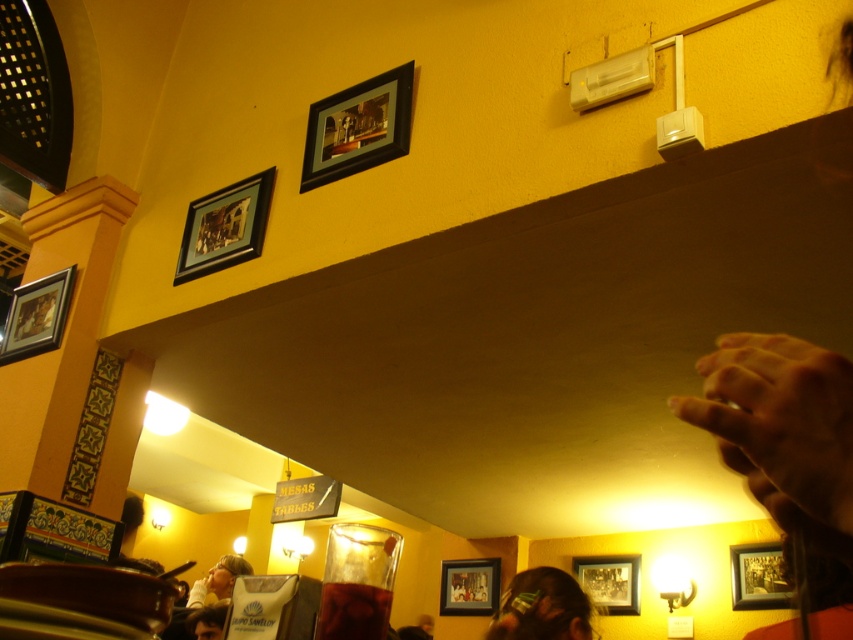
Question: Which point appears farthest from the camera in this image?

Choices:
 (A) (378, 148)
 (B) (41, 282)

Answer: (B)

Question: Is dark brown hair at lower center smaller than wooden picture frame at lower right?

Choices:
 (A) no
 (B) yes

Answer: (B)

Question: Is dark brown hair at lower center above wooden frame at left?

Choices:
 (A) no
 (B) yes

Answer: (A)

Question: Which object is positioned farthest from the wooden picture frame at lower center?

Choices:
 (A) dark brown hair at lower center
 (B) wooden frame at left
 (C) black matte picture frame at upper center
 (D) wooden picture frame at lower right

Answer: (C)

Question: From the image, what is the correct spatial relationship of black matte picture frame at upper center in relation to wooden frame at lower right?

Choices:
 (A) below
 (B) above

Answer: (B)

Question: Which of the following is the closest to the observer?

Choices:
 (A) (573, 604)
 (B) (805, 444)
 (C) (41, 282)

Answer: (B)